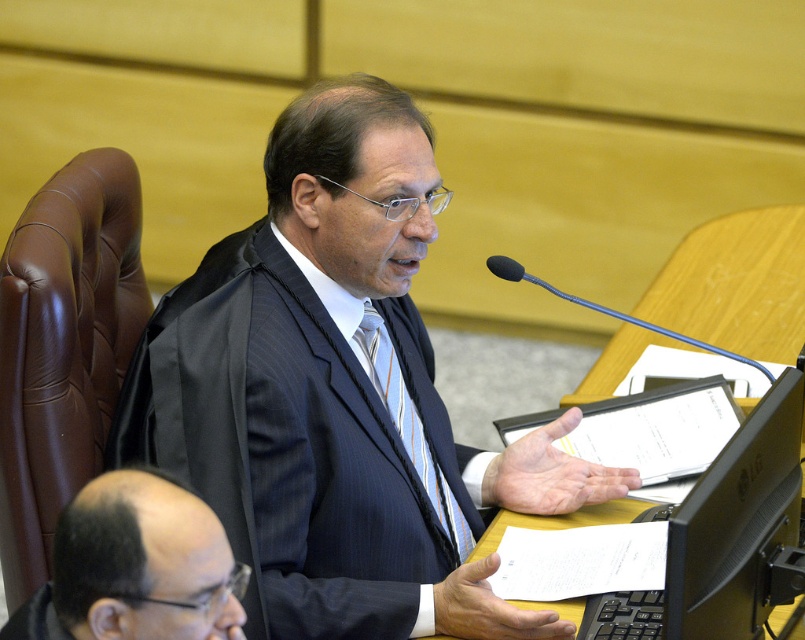
You are an architect designing a new courtroom layout and need to place a desk exactly where the dark blue pinstripe suit at center is located. What are the coordinates for the desk placement?

The coordinates for placing the desk where the dark blue pinstripe suit at center is located are at point (283, 445).

You are an observer in the courtroom. You notice the bald head at lower left and the blue striped tie at center. Which object is closer to you?

The bald head at lower left is closer to you because it is in front of the blue striped tie at center.